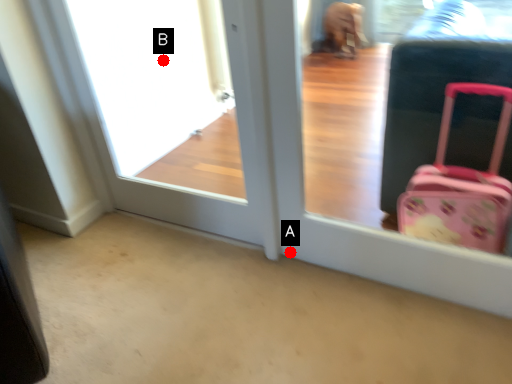
Question: Two points are circled on the image, labeled by A and B beside each circle. Which point is further to the camera?

Choices:
 (A) A is further
 (B) B is further

Answer: (B)